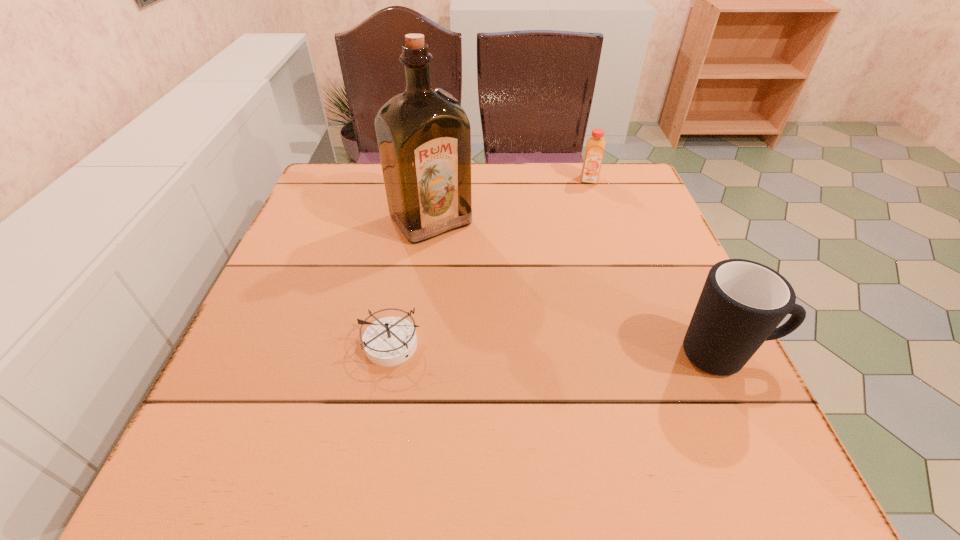
Find the location of a particular element. This screenshot has width=960, height=540. object present at the near right corner is located at coordinates (742, 302).

Find the location of a particular element. The image size is (960, 540). free point at the far edge is located at coordinates (481, 198).

Where is `vacant region at the near edge of the desktop`? vacant region at the near edge of the desktop is located at coordinates (543, 386).

The width and height of the screenshot is (960, 540). Identify the location of free space at the left edge. (282, 366).

Identify the location of vacant region at the right edge. (690, 362).

The width and height of the screenshot is (960, 540). I want to click on free space at the far left corner, so click(346, 188).

The height and width of the screenshot is (540, 960). In order to click on vacant space at the far right corner of the desktop in this screenshot , I will do `click(631, 190)`.

Identify the location of free spot between the rightmost object and the third tallest object. (658, 267).

Image resolution: width=960 pixels, height=540 pixels. What are the coordinates of `free space between the third shortest object and the compass` in the screenshot? It's located at (560, 349).

Identify the location of vacant point located between the compass and the orange juice. (492, 262).